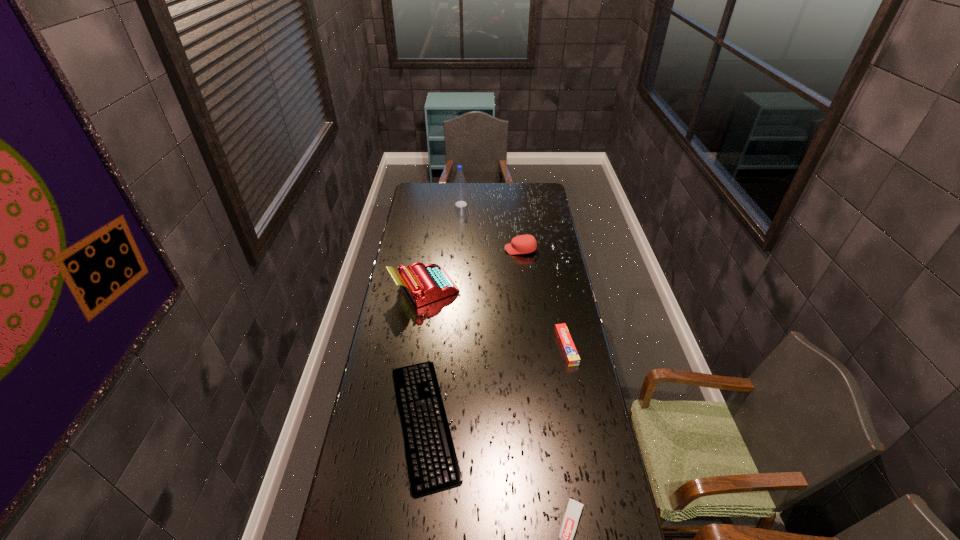
At what (x,y) coordinates should I click in order to perform the action: click on water bottle. Please return your answer as a coordinate pair (x, y). Image resolution: width=960 pixels, height=540 pixels. Looking at the image, I should click on (460, 195).

Where is `the farthest object`? Image resolution: width=960 pixels, height=540 pixels. the farthest object is located at coordinates (460, 195).

The image size is (960, 540). Identify the location of typewriter. (427, 283).

What are the coordinates of `the fourth nearest object` in the screenshot? It's located at (427, 283).

Image resolution: width=960 pixels, height=540 pixels. I want to click on the second farthest object, so pos(522,244).

Identify the location of cap. The height and width of the screenshot is (540, 960). (522, 244).

At what (x,y) coordinates should I click in order to perform the action: click on the rightmost object. Please return your answer as a coordinate pair (x, y). The image size is (960, 540). Looking at the image, I should click on (570, 353).

The height and width of the screenshot is (540, 960). Find the location of `the farther toothpaste`. the farther toothpaste is located at coordinates (570, 353).

Image resolution: width=960 pixels, height=540 pixels. Identify the location of computer keyboard. (432, 462).

This screenshot has height=540, width=960. I want to click on vacant space located on the right of the water bottle, so click(x=514, y=204).